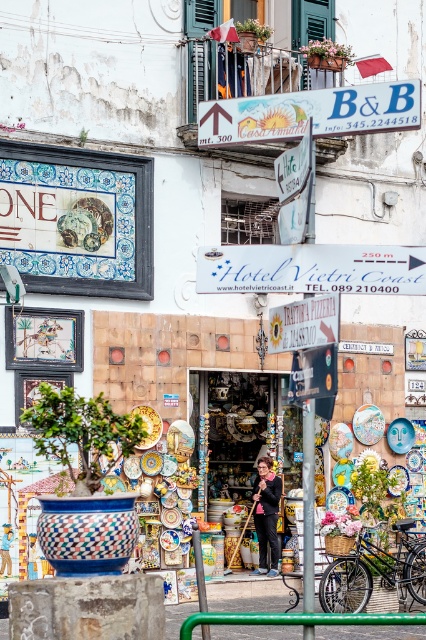
Is pink fabric jacket at center to the right of matte blue plate at center from the viewer's perspective?

No, pink fabric jacket at center is not to the right of matte blue plate at center.

Who is positioned more to the left, pink fabric jacket at center or matte blue plate at center?

From the viewer's perspective, pink fabric jacket at center appears more on the left side.

Who is more distant from viewer, (x=276, y=499) or (x=377, y=436)?

Positioned behind is point (x=377, y=436).

Identify the location of pink fabric jacket at center. coord(267,515).

Does white plastic sign at upper center appear on the left side of matte blue plate at center?

Indeed, white plastic sign at upper center is positioned on the left side of matte blue plate at center.

Can you confirm if white plastic sign at upper center is shorter than matte blue plate at center?

No.

You are a GUI agent. You are given a task and a screenshot of the screen. Output one action in this format:
    pyautogui.click(x=<x>, y=<y>)
    Task: Click on the white plastic sign at upper center
    
    Given the screenshot: What is the action you would take?
    pyautogui.click(x=310, y=113)

Is point (285, 621) less distant than point (373, 444)?

Yes, it is in front of point (373, 444).

Is green metal rail at lower center to the right of matte blue plate at center from the viewer's perspective?

No, green metal rail at lower center is not to the right of matte blue plate at center.

Image resolution: width=426 pixels, height=640 pixels. I want to click on green metal rail at lower center, so click(x=296, y=620).